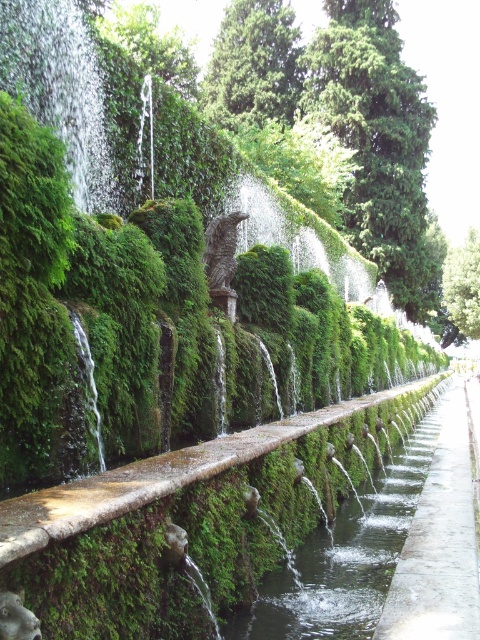
Question: Is clear water at center to the left of concrete at center from the viewer's perspective?

Choices:
 (A) no
 (B) yes

Answer: (B)

Question: Estimate the real-world distances between objects in this image. Which object is farther from the clear water at center?

Choices:
 (A) concrete at center
 (B) green mossy wall at upper left

Answer: (B)

Question: Does clear water at center appear on the left side of green mossy wall at upper left?

Choices:
 (A) no
 (B) yes

Answer: (A)

Question: Is concrete at center bigger than green mossy wall at upper left?

Choices:
 (A) no
 (B) yes

Answer: (B)

Question: Which object is farther from the camera taking this photo?

Choices:
 (A) clear water at center
 (B) green mossy wall at upper left
 (C) concrete at center

Answer: (B)

Question: Which object appears closest to the camera in this image?

Choices:
 (A) clear water at center
 (B) concrete at center
 (C) green mossy wall at upper left

Answer: (B)